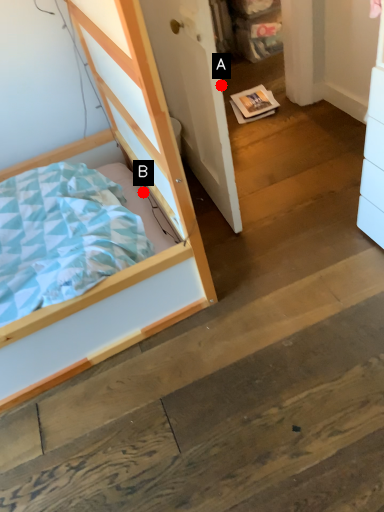
Question: Two points are circled on the image, labeled by A and B beside each circle. Which point is farther from the camera taking this photo?

Choices:
 (A) A is further
 (B) B is further

Answer: (B)